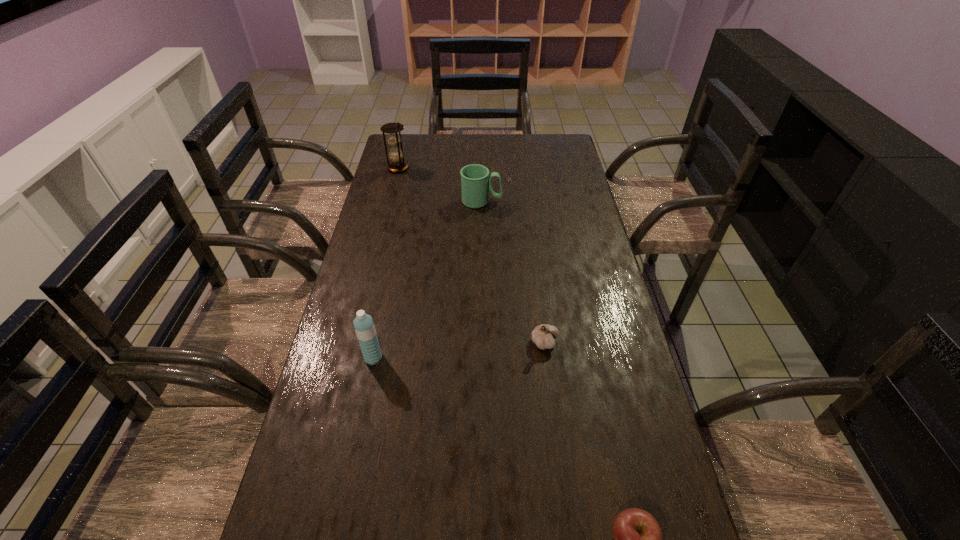
You are a GUI agent. You are given a task and a screenshot of the screen. Output one action in this format:
    pyautogui.click(x=<x>, y=<y>)
    Task: Click on the free spot between the water bottle and the hourglass
    This screenshot has height=540, width=960.
    Given the screenshot: What is the action you would take?
    [386, 263]

Select which object appears as the closest to the second object from right to left. Please provide its 2D coordinates. Your answer should be formatted as a tuple, i.e. [(x, y)], where the tuple contains the x and y coordinates of a point satisfying the conditions above.

[(364, 326)]

Where is `the second closest object to the hourglass`? This screenshot has width=960, height=540. the second closest object to the hourglass is located at coordinates (364, 326).

Image resolution: width=960 pixels, height=540 pixels. I want to click on vacant point that satisfies the following two spatial constraints: 1. on the side of the mug with the handle; 2. on the right side of the garlic, so click(x=482, y=342).

This screenshot has height=540, width=960. Identify the location of vacant area in the image that satisfies the following two spatial constraints: 1. on the side of the fourth object from left to right with the handle; 2. on the right side of the mug. (482, 342).

Locate an element on the screen. The width and height of the screenshot is (960, 540). vacant region that satisfies the following two spatial constraints: 1. on the side of the third object from left to right with the handle; 2. on the left side of the second object from right to left is located at coordinates (482, 342).